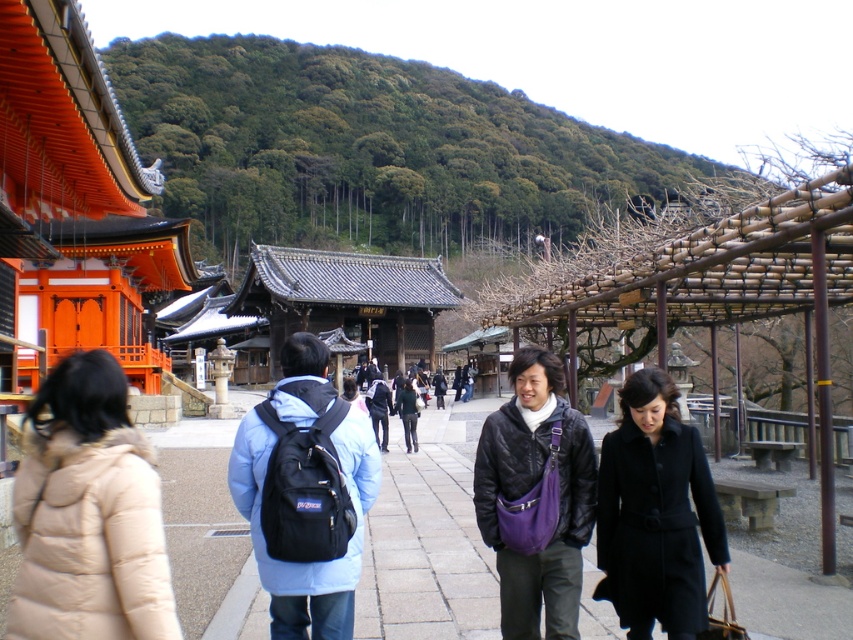
Question: Can you confirm if paved stone walkway at center is positioned to the left of black matte coat at center?

Choices:
 (A) no
 (B) yes

Answer: (B)

Question: Which object appears closest to the camera in this image?

Choices:
 (A) black matte coat at center
 (B) paved stone walkway at center

Answer: (A)

Question: Which point is farther to the camera?

Choices:
 (A) (759, 588)
 (B) (712, 518)
 (C) (108, 477)

Answer: (A)

Question: Which object appears closest to the camera in this image?

Choices:
 (A) black matte coat at center
 (B) paved stone walkway at center
 (C) beige puffer jacket at lower left

Answer: (C)

Question: Can you confirm if paved stone walkway at center is wider than black matte coat at center?

Choices:
 (A) no
 (B) yes

Answer: (B)

Question: Does paved stone walkway at center come behind black matte coat at center?

Choices:
 (A) yes
 (B) no

Answer: (A)